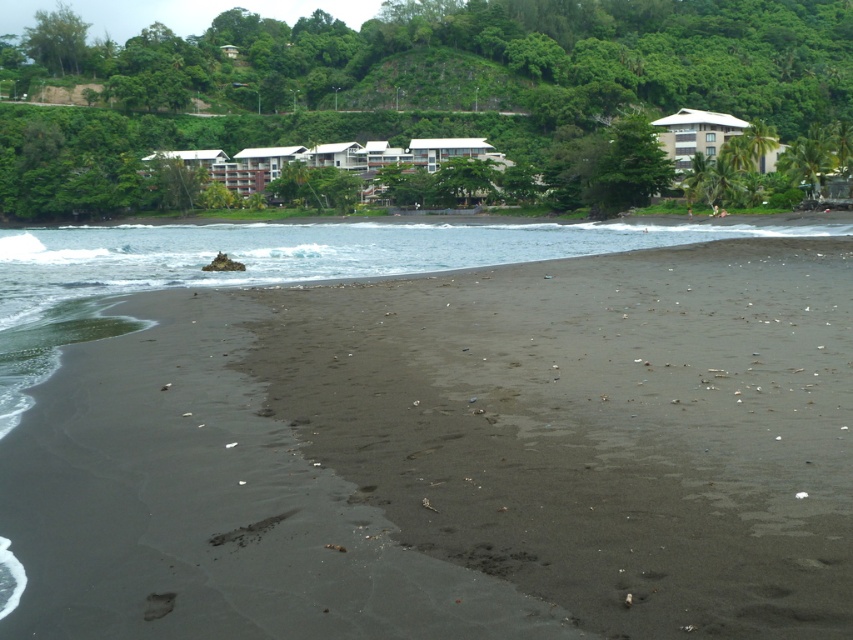
You are a photographer planning to capture the white matte building at center and the dark sand at center in a single shot. Based on their positions, which object should you place closer to the left side of your camera frame?

The white matte building at center should be placed closer to the left side of your camera frame because the dark sand at center is positioned on the right side of it.

You are a photographer planning to capture the contrast between the dark sand at center and the white matte building at center. Based on their sizes in the image, which one would appear more prominent in your photo?

The white matte building at center appears more prominent because it is larger than the dark sand at center.

You are a photographer planning to capture a sunset shot at this coastal location. You want to ensure the dark sand at center and the white matte building at center are both visible in the frame. Which object will appear taller in the photograph?

The white matte building at center will appear taller in the photograph because it is taller than the dark sand at center according to the description.